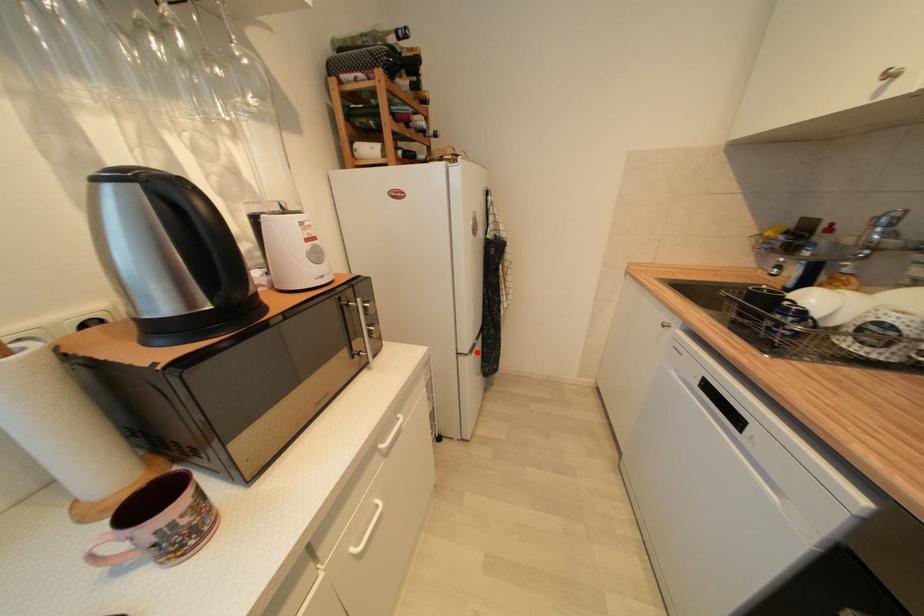
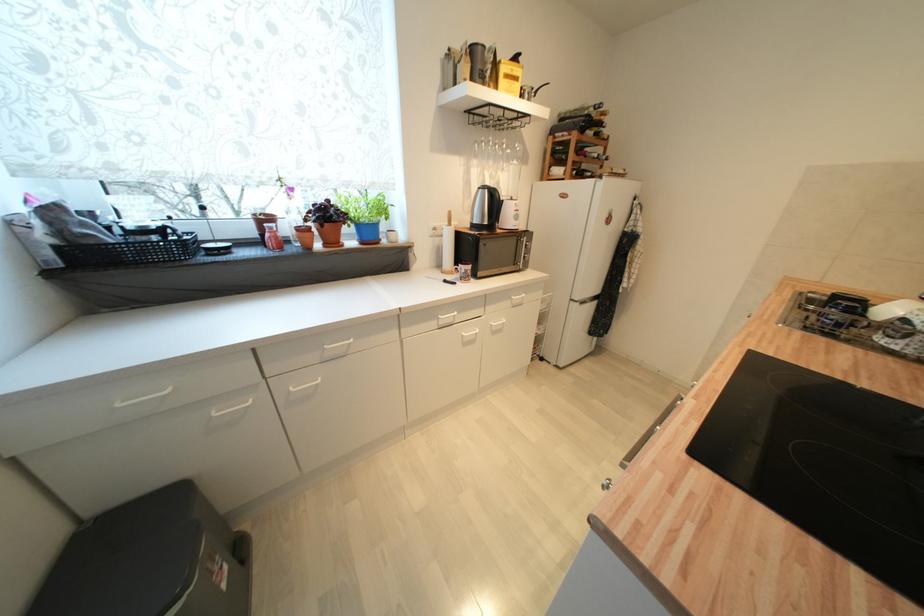
In the second image, find the point that corresponds to the highlighted location in the first image.

(587, 304)